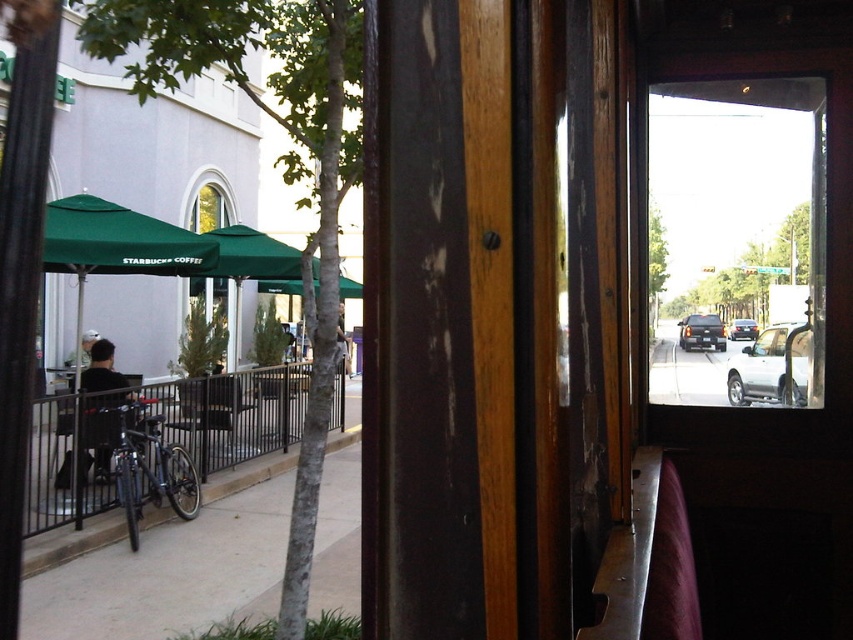
You are a customer at the cafe and want to take a photo of the shiny black bicycle at left and the dark gray shirt at center through the window. Which object should you focus on first if you want both to be in focus?

The shiny black bicycle at left is below the dark gray shirt at center, so you should focus on the dark gray shirt at center first because it is closer to the camera.

You are a delivery person who needs to park your shiny black bicycle at left. There is a silver metallic sedan at center blocking the entrance. Can you move the bicycle without moving the sedan?

The shiny black bicycle at left is positioned under the silver metallic sedan at center, so you cannot move the bicycle without moving the sedan because the sedan is blocking its path.